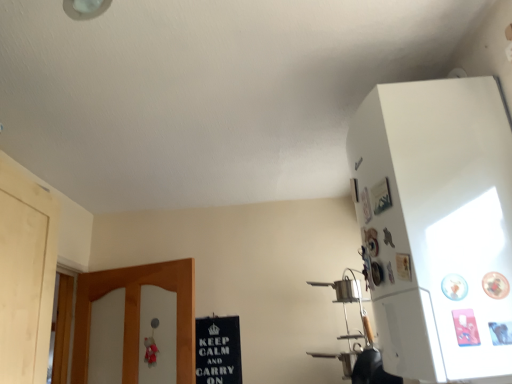
The image size is (512, 384). What are the coordinates of `white matte refrigerator at upper right` in the screenshot? It's located at (437, 225).

Image resolution: width=512 pixels, height=384 pixels. What do you see at coordinates (437, 225) in the screenshot?
I see `white matte refrigerator at upper right` at bounding box center [437, 225].

What is the approximate width of black cardboard sign at lower center?

It is 0.81 inches.

Locate an element on the screen. This screenshot has height=384, width=512. black cardboard sign at lower center is located at coordinates (218, 350).

Describe the element at coordinates (218, 350) in the screenshot. The width and height of the screenshot is (512, 384). I see `black cardboard sign at lower center` at that location.

Identify the location of white matte refrigerator at upper right. The height and width of the screenshot is (384, 512). (437, 225).

Considering the relative positions of white matte refrigerator at upper right and black cardboard sign at lower center in the image provided, is white matte refrigerator at upper right to the left of black cardboard sign at lower center from the viewer's perspective?

In fact, white matte refrigerator at upper right is to the right of black cardboard sign at lower center.

Which object is further away from the camera, white matte refrigerator at upper right or black cardboard sign at lower center?

black cardboard sign at lower center is more distant.

Does point (406, 359) come behind point (236, 349)?

No.

From the image's perspective, is white matte refrigerator at upper right located above or below black cardboard sign at lower center?

white matte refrigerator at upper right is situated higher than black cardboard sign at lower center in the image.

From a real-world perspective, is white matte refrigerator at upper right above or below black cardboard sign at lower center?

In terms of real-world spatial position, white matte refrigerator at upper right is above black cardboard sign at lower center.

Which of these two, white matte refrigerator at upper right or black cardboard sign at lower center, is wider?

white matte refrigerator at upper right.

Considering the relative sizes of white matte refrigerator at upper right and black cardboard sign at lower center in the image provided, is white matte refrigerator at upper right taller than black cardboard sign at lower center?

Yes.

Can you confirm if white matte refrigerator at upper right is bigger than black cardboard sign at lower center?

Yes.

Is white matte refrigerator at upper right inside the boundaries of black cardboard sign at lower center, or outside?

white matte refrigerator at upper right is spatially situated outside black cardboard sign at lower center.

Is the surface of white matte refrigerator at upper right in direct contact with black cardboard sign at lower center?

white matte refrigerator at upper right and black cardboard sign at lower center are clearly separated.

Does white matte refrigerator at upper right turn towards black cardboard sign at lower center?

No, white matte refrigerator at upper right is not aimed at black cardboard sign at lower center.

Looking at this image, how many degrees apart are the facing directions of white matte refrigerator at upper right and black cardboard sign at lower center?

The angle between the facing direction of white matte refrigerator at upper right and the facing direction of black cardboard sign at lower center is 87.5 degrees.

In order to click on cabinetry in front of the black cardboard sign at lower center in this screenshot , I will do `click(437, 225)`.

Considering the positions of objects black cardboard sign at lower center and white matte refrigerator at upper right in the image provided, who is more to the right, black cardboard sign at lower center or white matte refrigerator at upper right?

white matte refrigerator at upper right.

Does black cardboard sign at lower center lie in front of white matte refrigerator at upper right?

No, it is behind white matte refrigerator at upper right.

Which is in front, point (221, 350) or point (465, 141)?

The point (465, 141) is closer to the camera.

From the image's perspective, is black cardboard sign at lower center over white matte refrigerator at upper right?

Actually, black cardboard sign at lower center appears below white matte refrigerator at upper right in the image.

From a real-world perspective, is black cardboard sign at lower center physically located above or below white matte refrigerator at upper right?

Clearly, from a real-world perspective, black cardboard sign at lower center is below white matte refrigerator at upper right.

Is black cardboard sign at lower center wider or thinner than white matte refrigerator at upper right?

black cardboard sign at lower center is thinner than white matte refrigerator at upper right.

From the picture: Who is taller, black cardboard sign at lower center or white matte refrigerator at upper right?

Standing taller between the two is white matte refrigerator at upper right.

Between black cardboard sign at lower center and white matte refrigerator at upper right, which one has larger size?

white matte refrigerator at upper right is bigger.

Is black cardboard sign at lower center inside or outside of white matte refrigerator at upper right?

black cardboard sign at lower center is outside white matte refrigerator at upper right.

Is black cardboard sign at lower center placed right next to white matte refrigerator at upper right?

black cardboard sign at lower center is not next to white matte refrigerator at upper right, and they're not touching.

Is black cardboard sign at lower center facing towards white matte refrigerator at upper right?

No, black cardboard sign at lower center is not aimed at white matte refrigerator at upper right.

How many degrees apart are the facing directions of black cardboard sign at lower center and white matte refrigerator at upper right?

There is a 87.5-degree angle between the facing directions of black cardboard sign at lower center and white matte refrigerator at upper right.

At what (x,y) coordinates should I click in order to perform the action: click on bulletin board on the left of white matte refrigerator at upper right. Please return your answer as a coordinate pair (x, y). Looking at the image, I should click on (218, 350).

The width and height of the screenshot is (512, 384). What are the coordinates of `bulletin board that appears below the white matte refrigerator at upper right (from the image's perspective)` in the screenshot? It's located at [218, 350].

Locate an element on the screen. The image size is (512, 384). cabinetry above the black cardboard sign at lower center (from the image's perspective) is located at coordinates (437, 225).